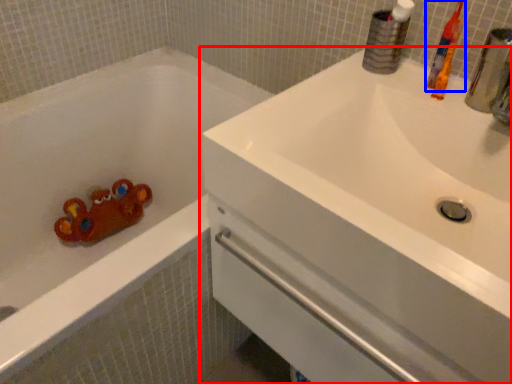
Question: Which of the following is the closest to the observer, sink (highlighted by a red box) or toothbrush (highlighted by a blue box)?

Choices:
 (A) sink
 (B) toothbrush

Answer: (A)